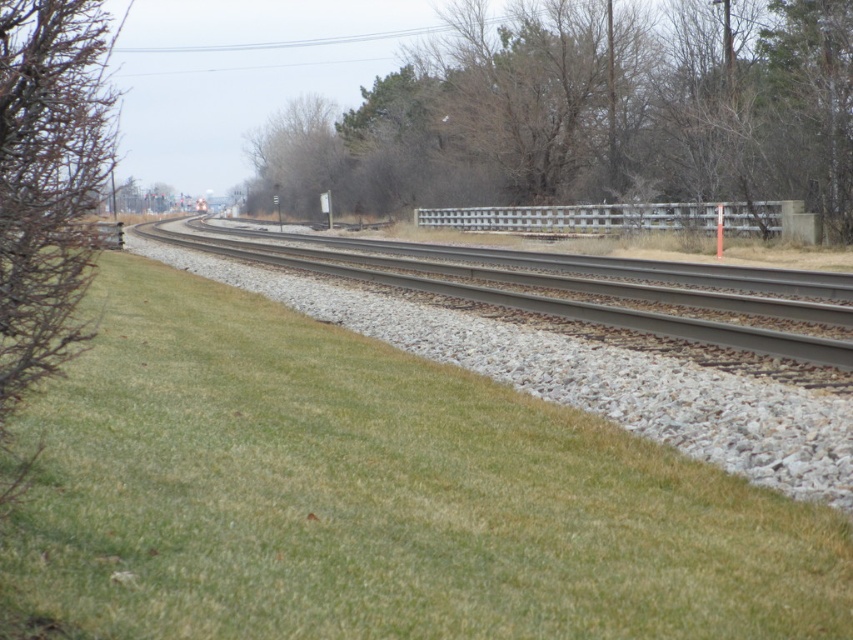
Who is positioned more to the right, green grassy at center or gray metallic tracks at center?

green grassy at center is more to the right.

Which is behind, point (180, 561) or point (705, 314)?

Point (705, 314)

You are a GUI agent. You are given a task and a screenshot of the screen. Output one action in this format:
    pyautogui.click(x=<x>, y=<y>)
    Task: Click on the green grassy at center
    This screenshot has height=640, width=853.
    Given the screenshot: What is the action you would take?
    pyautogui.click(x=372, y=497)

Is gray metallic tracks at center below brown textured bush at left?

Correct, gray metallic tracks at center is located below brown textured bush at left.

The height and width of the screenshot is (640, 853). What do you see at coordinates (573, 285) in the screenshot? I see `gray metallic tracks at center` at bounding box center [573, 285].

Which is behind, point (267, 234) or point (102, 99)?

Positioned behind is point (102, 99).

I want to click on gray metallic tracks at center, so click(x=573, y=285).

Does bare branches at center have a greater height compared to brown textured bush at left?

No.

Between bare branches at center and brown textured bush at left, which one has more height?

brown textured bush at left

Find the location of `bare branches at center`. bare branches at center is located at coordinates (590, 113).

Where is `bare branches at center`? The width and height of the screenshot is (853, 640). bare branches at center is located at coordinates (590, 113).